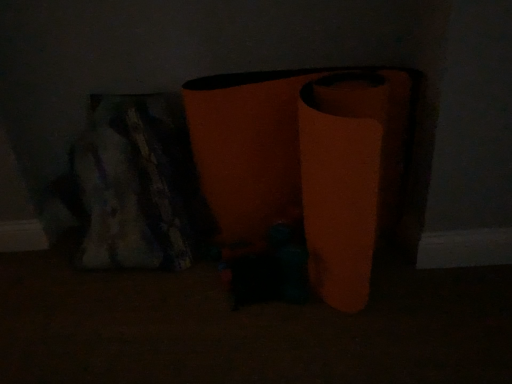
At what (x,y) coordinates should I click in order to perform the action: click on free space in front of orange matte vase at center. Please return your answer as a coordinate pair (x, y). Image resolution: width=512 pixels, height=384 pixels. Looking at the image, I should click on (329, 342).